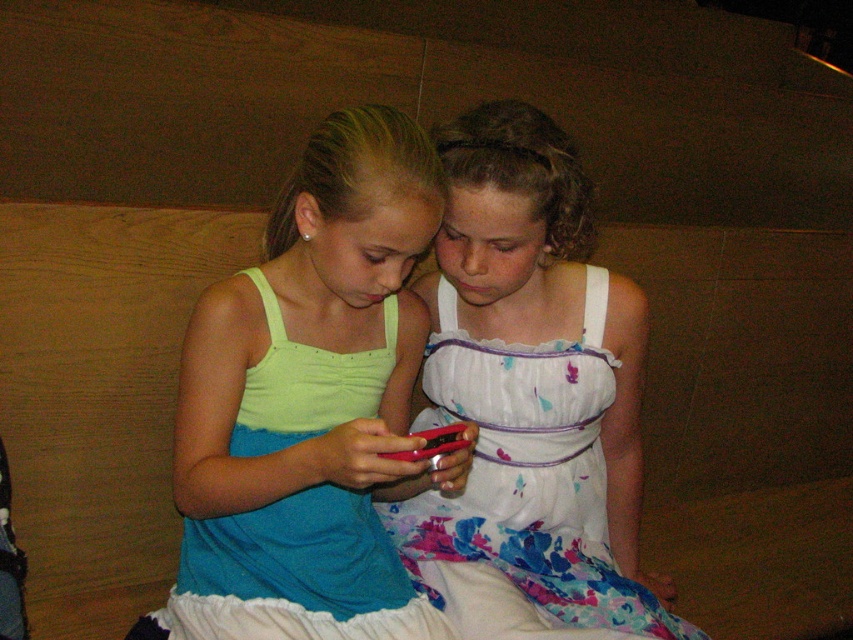
Question: Among these objects, which one is nearest to the camera?

Choices:
 (A) matte red phone at center
 (B) matte green tank top at center

Answer: (B)

Question: Which of these objects is positioned farthest from the white floral fabric dress at center?

Choices:
 (A) matte red phone at center
 (B) matte green tank top at center

Answer: (A)

Question: Where is white floral fabric dress at center located in relation to matte red phone at center in the image?

Choices:
 (A) left
 (B) right

Answer: (B)

Question: Which point is closer to the camera?

Choices:
 (A) (432, 452)
 (B) (529, 518)
 (C) (392, 259)

Answer: (A)

Question: Does matte green tank top at center have a greater width compared to matte red phone at center?

Choices:
 (A) yes
 (B) no

Answer: (A)

Question: Does white floral fabric dress at center have a lesser width compared to matte red phone at center?

Choices:
 (A) yes
 (B) no

Answer: (B)